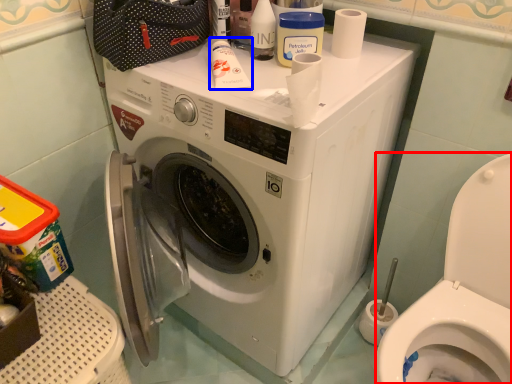
Question: Which point is further to the camera, bidet (highlighted by a red box) or toiletry (highlighted by a blue box)?

Choices:
 (A) bidet
 (B) toiletry

Answer: (B)